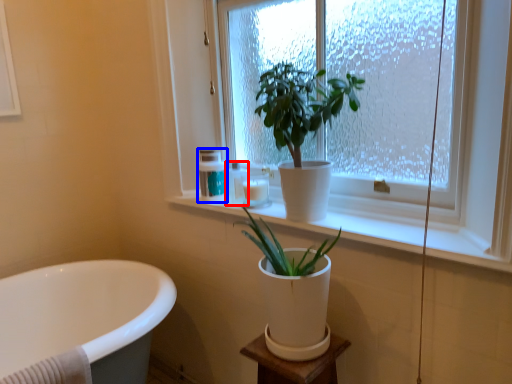
Question: Which point is closer to the camera, toiletry (highlighted by a red box) or toiletry (highlighted by a blue box)?

Choices:
 (A) toiletry
 (B) toiletry

Answer: (A)